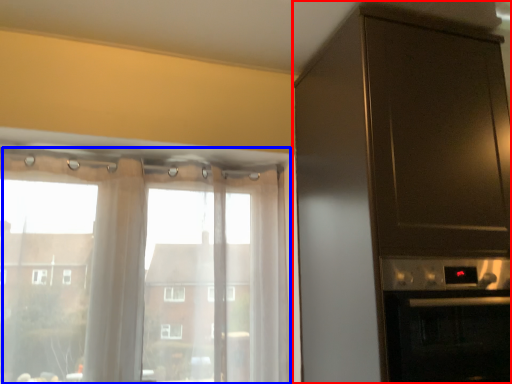
Question: Which object is further to the camera taking this photo, cabinetry (highlighted by a red box) or window (highlighted by a blue box)?

Choices:
 (A) cabinetry
 (B) window

Answer: (B)